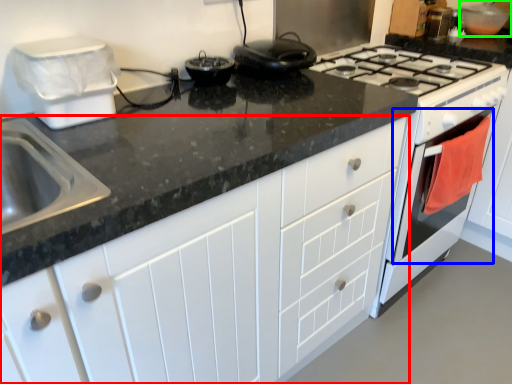
Question: Which object is the closest to the cabinetry (highlighted by a red box)? Choose among these: oven (highlighted by a blue box) or appliance (highlighted by a green box).

Choices:
 (A) oven
 (B) appliance

Answer: (A)